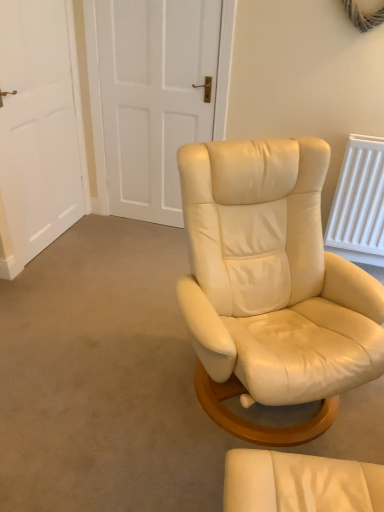
Question: Does matte cream leather chair at center have a greater width compared to white matte door at upper center, the first door positioned from the right?

Choices:
 (A) yes
 (B) no

Answer: (A)

Question: Does matte cream leather chair at center have a lesser width compared to white matte door at upper center, acting as the 2th door starting from the left?

Choices:
 (A) no
 (B) yes

Answer: (A)

Question: Would you say matte cream leather chair at center contains white matte door at upper center, acting as the 2th door starting from the left?

Choices:
 (A) no
 (B) yes

Answer: (A)

Question: Is matte cream leather chair at center in front of white matte door at upper center, acting as the 2th door starting from the left?

Choices:
 (A) yes
 (B) no

Answer: (A)

Question: Would you consider matte cream leather chair at center to be distant from white matte door at upper center, the first door positioned from the right?

Choices:
 (A) yes
 (B) no

Answer: (A)

Question: Does matte cream leather chair at center have a greater height compared to white matte door at upper center, acting as the 2th door starting from the left?

Choices:
 (A) yes
 (B) no

Answer: (B)

Question: Is white matte door at upper center, the first door positioned from the right, smaller than white matte door at upper left, which is counted as the 1th door, starting from the left?

Choices:
 (A) no
 (B) yes

Answer: (A)

Question: Considering the relative positions of white matte door at upper center, the first door positioned from the right, and white matte door at upper left, which is counted as the 1th door, starting from the left, in the image provided, is white matte door at upper center, the first door positioned from the right, to the right of white matte door at upper left, which is counted as the 1th door, starting from the left, from the viewer's perspective?

Choices:
 (A) no
 (B) yes

Answer: (B)

Question: Considering the relative sizes of white matte door at upper center, the first door positioned from the right, and white matte door at upper left, acting as the second door starting from the right, in the image provided, is white matte door at upper center, the first door positioned from the right, thinner than white matte door at upper left, acting as the second door starting from the right,?

Choices:
 (A) no
 (B) yes

Answer: (A)

Question: Does white matte door at upper center, acting as the 2th door starting from the left, touch white matte door at upper left, which is counted as the 1th door, starting from the left?

Choices:
 (A) no
 (B) yes

Answer: (A)

Question: Would you consider white matte door at upper center, acting as the 2th door starting from the left, to be distant from white matte door at upper left, acting as the second door starting from the right?

Choices:
 (A) no
 (B) yes

Answer: (A)

Question: Is white matte door at upper center, the first door positioned from the right, taller than white matte door at upper left, which is counted as the 1th door, starting from the left?

Choices:
 (A) no
 (B) yes

Answer: (B)

Question: Is white matte door at upper center, the first door positioned from the right, smaller than matte cream leather chair at center?

Choices:
 (A) yes
 (B) no

Answer: (B)